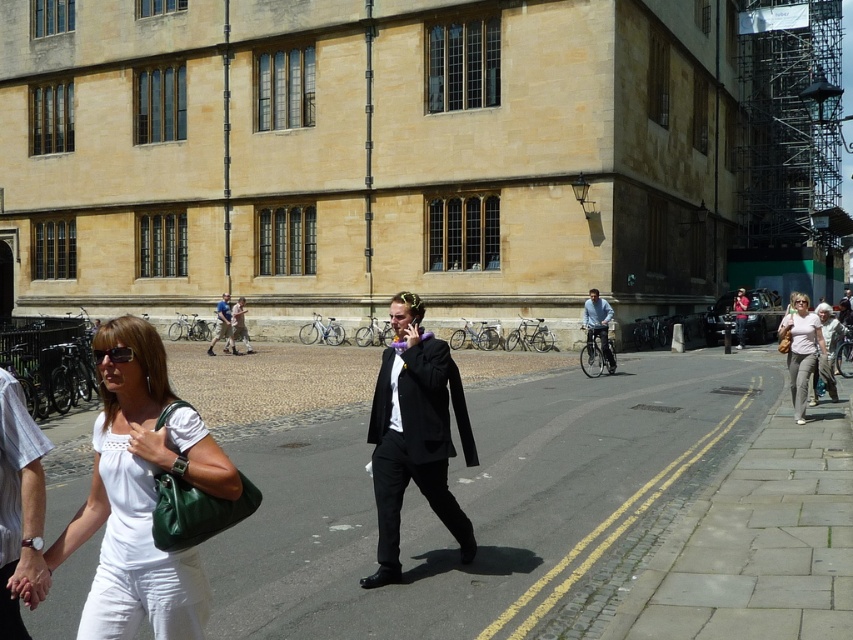
Question: Considering the relative positions of white fabric dress at left and blue denim jeans at center in the image provided, where is white fabric dress at left located with respect to blue denim jeans at center?

Choices:
 (A) left
 (B) right

Answer: (B)

Question: Which of the following is the farthest from the observer?

Choices:
 (A) (231, 332)
 (B) (399, 372)
 (C) (0, 573)
 (D) (238, 321)

Answer: (D)

Question: Does white fabric dress at left appear on the right side of black matte suit at center?

Choices:
 (A) no
 (B) yes

Answer: (A)

Question: Is the position of black matte suit at center more distant than that of light blue shirt at center?

Choices:
 (A) no
 (B) yes

Answer: (A)

Question: Estimate the real-world distances between objects in this image. Which object is closer to the white fabric dress at left?

Choices:
 (A) white cotton dress at lower left
 (B) black matte suit at center
 (C) white cotton shirt at lower left
 (D) light blue shirt at center

Answer: (A)

Question: Which object is the closest to the pink cotton shirt at center?

Choices:
 (A) matte black suit at center
 (B) white cotton shirt at lower left
 (C) white fabric dress at left

Answer: (C)